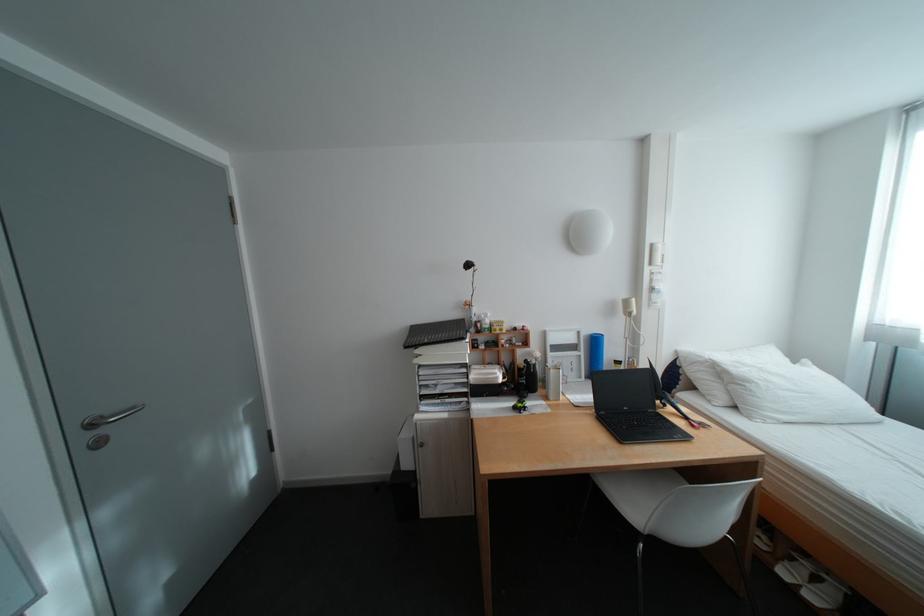
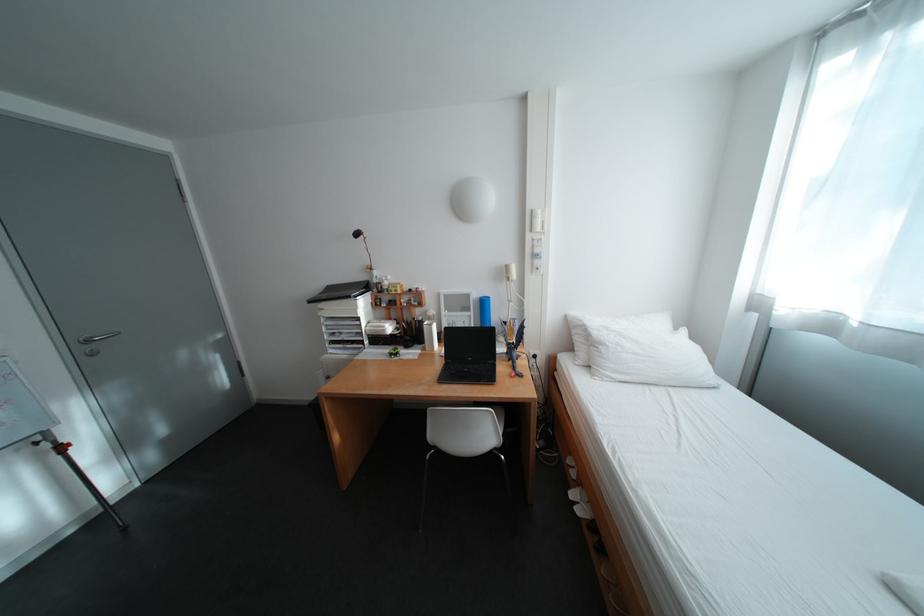
The point at [544,371] is marked in the first image. Where is the corresponding point in the second image?

(430, 326)